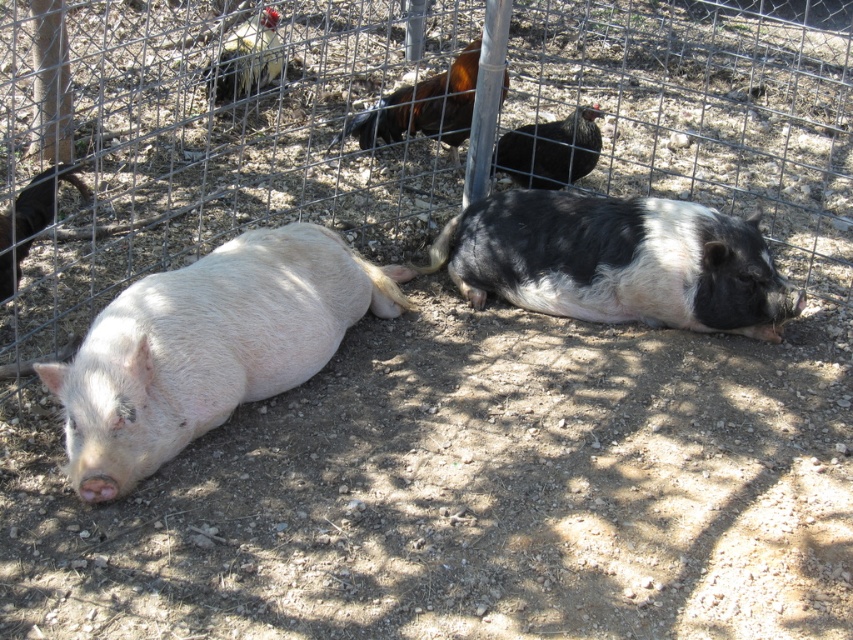
You are standing in front of the fenced area where the pigs are resting. There are two points marked in the image. The first point is at coordinate point (x=219, y=278) and the second is at point (x=508, y=298). If you want to place a small treat exactly halfway between these two points, will the treat be closer to the ground or the fence?

The treat placed halfway between point (x=219, y=278) and point (x=508, y=298) will be closer to the ground because the first point is closer to the camera, meaning it is lower in the scene, so the midpoint would still be nearer to the ground level.

You are a farmer who needs to check the distance between the matte pink pig at left and the black and white fur at center to ensure they are not too close. The recommended minimum distance for their safety is 36 inches. Can you confirm if they are within the safe distance?

The distance between the matte pink pig at left and the black and white fur at center is 34.37 inches, which is less than the recommended 36 inches. Therefore, they are too close and not within the safe distance.

You are a farmer checking the coordinates of the animals in your field. You need to locate the matte pink pig at left. What are its coordinates?

The matte pink pig at left is located at point (207,346).